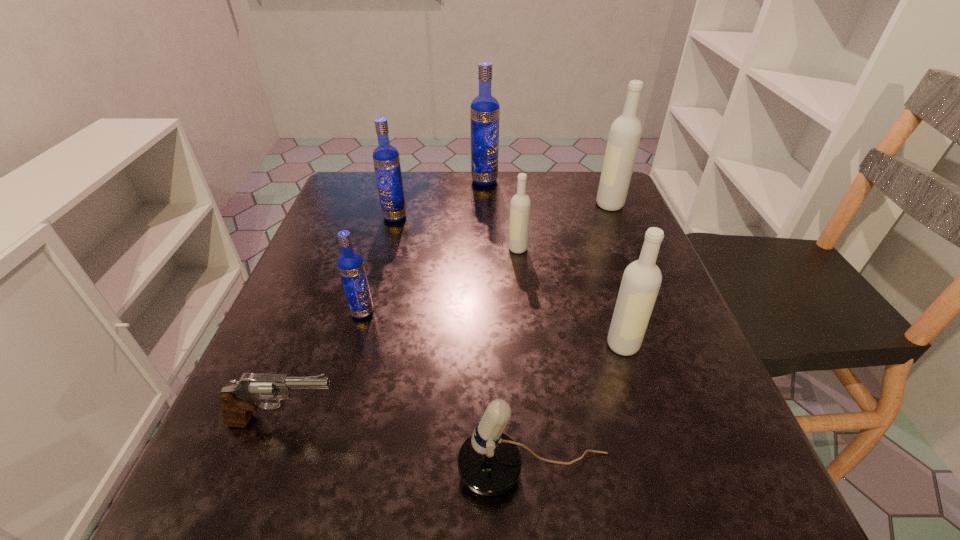
Find the location of a particular element. Image resolution: width=960 pixels, height=540 pixels. vacant space in between the second nearest white vodka and the second smallest white vodka is located at coordinates (570, 296).

Where is `unoccupied area between the farthest vodka and the second nearest vodka`? Image resolution: width=960 pixels, height=540 pixels. unoccupied area between the farthest vodka and the second nearest vodka is located at coordinates [423, 246].

At what (x,y) coordinates should I click in order to perform the action: click on free space between the farthest blue vodka and the rightmost vodka. Please return your answer as a coordinate pair (x, y). This screenshot has height=540, width=960. Looking at the image, I should click on (547, 193).

Locate an element on the screen. empty space between the smallest blue vodka and the farthest vodka is located at coordinates (423, 246).

In order to click on object that is the fifth closest to the second nearest object in this screenshot , I will do `click(386, 159)`.

Image resolution: width=960 pixels, height=540 pixels. What are the coordinates of `the sixth closest object relative to the second biggest blue vodka` in the screenshot? It's located at (641, 281).

I want to click on vodka that is the nearest to the second biggest blue vodka, so click(x=485, y=111).

At what (x,y) coordinates should I click in order to perform the action: click on vodka that stands as the third closest to the gray pistol. Please return your answer as a coordinate pair (x, y). Looking at the image, I should click on (520, 205).

Locate an element on the screen. This screenshot has height=540, width=960. blue vodka that stands as the closest to the nearest object is located at coordinates (350, 264).

Identify which blue vodka is the second closest to the smallest white vodka. Please provide its 2D coordinates. Your answer should be formatted as a tuple, i.e. [(x, y)], where the tuple contains the x and y coordinates of a point satisfying the conditions above.

[(386, 159)]